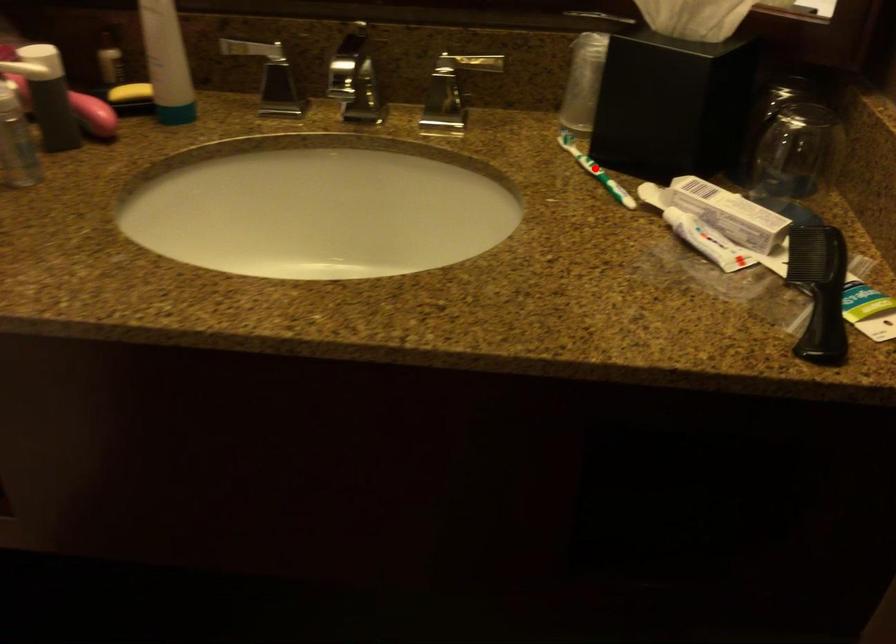
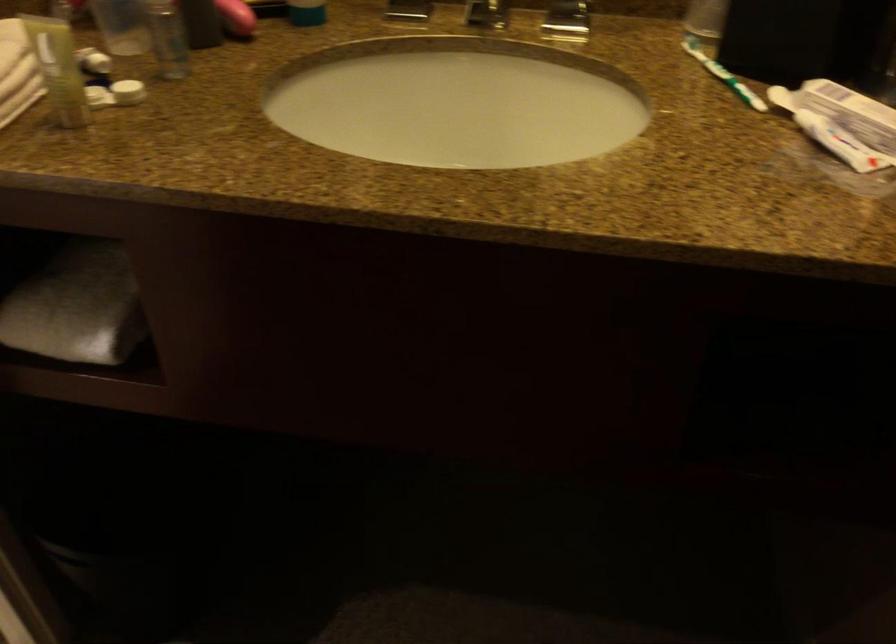
Find the pixel in the second image that matches the highlighted location in the first image.

(722, 75)